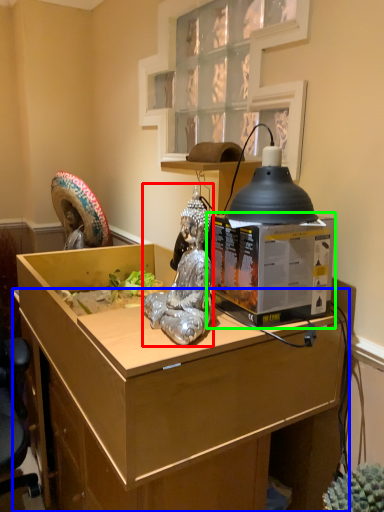
Question: Considering the real-world distances, which object is farthest from person (highlighted by a red box)? desk (highlighted by a blue box) or desktop computer (highlighted by a green box)?

Choices:
 (A) desk
 (B) desktop computer

Answer: (A)